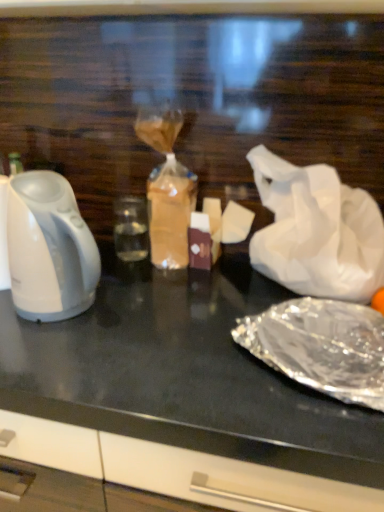
Question: Does shiny metallic foil at lower right contain black glossy table at center?

Choices:
 (A) no
 (B) yes

Answer: (A)

Question: Does shiny metallic foil at lower right have a lesser height compared to black glossy table at center?

Choices:
 (A) yes
 (B) no

Answer: (A)

Question: Considering the relative sizes of shiny metallic foil at lower right and black glossy table at center in the image provided, is shiny metallic foil at lower right wider than black glossy table at center?

Choices:
 (A) no
 (B) yes

Answer: (A)

Question: Are shiny metallic foil at lower right and black glossy table at center beside each other?

Choices:
 (A) yes
 (B) no

Answer: (B)

Question: Considering the relative sizes of shiny metallic foil at lower right and black glossy table at center in the image provided, is shiny metallic foil at lower right thinner than black glossy table at center?

Choices:
 (A) yes
 (B) no

Answer: (A)

Question: Is the depth of shiny metallic foil at lower right greater than that of black glossy table at center?

Choices:
 (A) yes
 (B) no

Answer: (A)

Question: From a real-world perspective, does black glossy table at center stand above white glossy kettle at left?

Choices:
 (A) yes
 (B) no

Answer: (B)

Question: Is black glossy table at center shorter than white glossy kettle at left?

Choices:
 (A) no
 (B) yes

Answer: (A)

Question: Does black glossy table at center have a greater height compared to white glossy kettle at left?

Choices:
 (A) no
 (B) yes

Answer: (B)

Question: Is the position of black glossy table at center less distant than that of white glossy kettle at left?

Choices:
 (A) yes
 (B) no

Answer: (A)

Question: Is black glossy table at center turned away from white glossy kettle at left?

Choices:
 (A) yes
 (B) no

Answer: (B)

Question: Is black glossy table at center further to the viewer compared to white glossy kettle at left?

Choices:
 (A) no
 (B) yes

Answer: (A)

Question: Is white glossy kettle at left at the left side of shiny metallic foil at lower right?

Choices:
 (A) yes
 (B) no

Answer: (A)